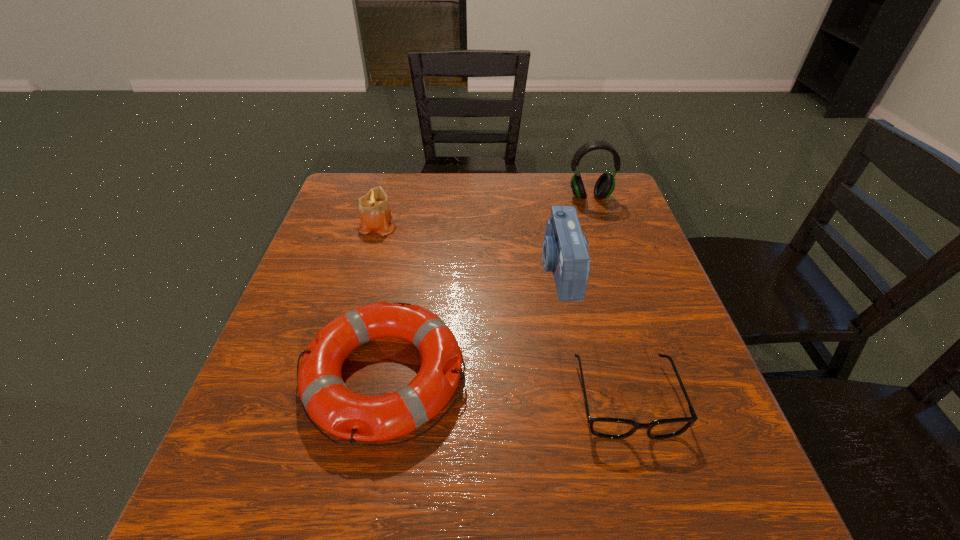
The width and height of the screenshot is (960, 540). Identify the location of free spot located on the right of the candle. (468, 225).

At what (x,y) coordinates should I click in order to perform the action: click on vacant region located on the right of the second shortest object. Please return your answer as a coordinate pair (x, y). The width and height of the screenshot is (960, 540). Looking at the image, I should click on 584,376.

Identify the location of free space located on the front-facing side of the shortest object. The width and height of the screenshot is (960, 540). (657, 514).

Find the location of a particular element. The width and height of the screenshot is (960, 540). headset that is positioned at the far edge is located at coordinates (605, 185).

The width and height of the screenshot is (960, 540). Identify the location of candle at the far edge. (375, 214).

Image resolution: width=960 pixels, height=540 pixels. Find the location of `candle located in the left edge section of the desktop`. candle located in the left edge section of the desktop is located at coordinates (375, 214).

Find the location of a particular element. The image size is (960, 540). life buoy at the left edge is located at coordinates (329, 403).

Where is `headset positioned at the right edge`? Image resolution: width=960 pixels, height=540 pixels. headset positioned at the right edge is located at coordinates (605, 185).

Locate an element on the screen. Image resolution: width=960 pixels, height=540 pixels. spectacles located at the right edge is located at coordinates (612, 428).

This screenshot has height=540, width=960. Find the location of `object situated at the far left corner`. object situated at the far left corner is located at coordinates (375, 214).